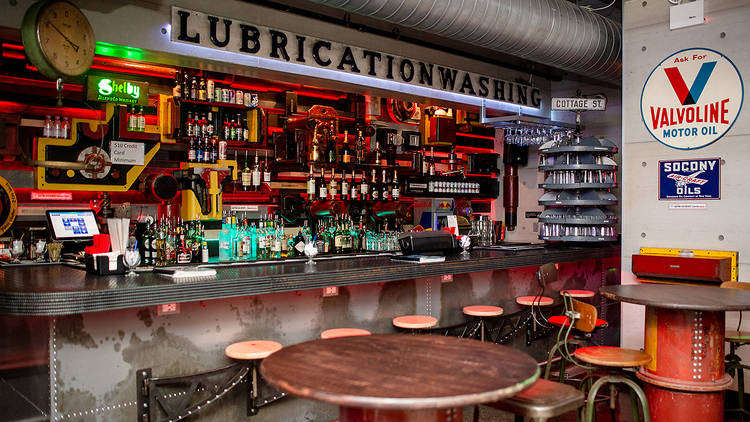
Locate an element on the screen. Image resolution: width=750 pixels, height=422 pixels. black bar counter is located at coordinates (72, 287).